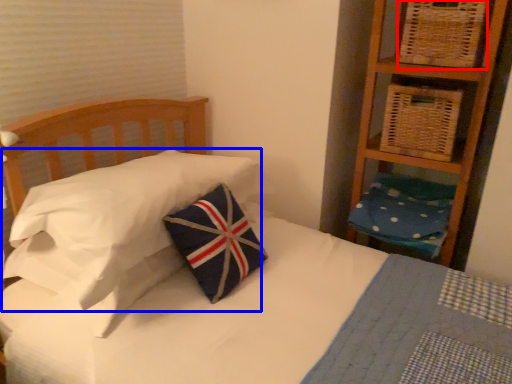
Question: Which of the following is the closest to the observer, basket (highlighted by a red box) or pillow (highlighted by a blue box)?

Choices:
 (A) basket
 (B) pillow

Answer: (B)